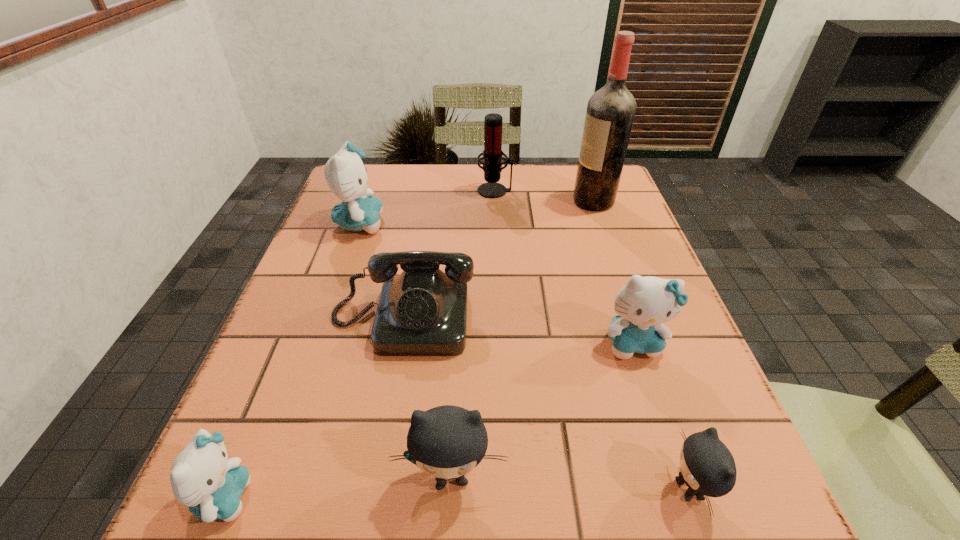
In order to click on the tallest object in this screenshot , I will do `click(610, 113)`.

Image resolution: width=960 pixels, height=540 pixels. Find the location of `red microphone`. red microphone is located at coordinates (492, 152).

Locate an element on the screen. The image size is (960, 540). the farthest kitten is located at coordinates (345, 174).

Image resolution: width=960 pixels, height=540 pixels. What are the coordinates of `the biggest blue kitten` in the screenshot? It's located at (345, 174).

Identify the location of the second nearest blue kitten. The image size is (960, 540). (644, 303).

At what (x,y) coordinates should I click in order to perform the action: click on the rightmost blue kitten. Please return your answer as a coordinate pair (x, y). This screenshot has height=540, width=960. Looking at the image, I should click on (644, 303).

Find the location of a particular element. Image resolution: width=960 pixels, height=540 pixels. the left gray kitten is located at coordinates (448, 442).

Locate an element on the screen. This screenshot has height=540, width=960. the third kitten from right to left is located at coordinates tap(448, 442).

This screenshot has height=540, width=960. In order to click on telephone in this screenshot , I will do `click(422, 312)`.

At what (x,y) coordinates should I click in order to perform the action: click on the nearest blue kitten. Please return your answer as a coordinate pair (x, y). The image size is (960, 540). Looking at the image, I should click on (202, 477).